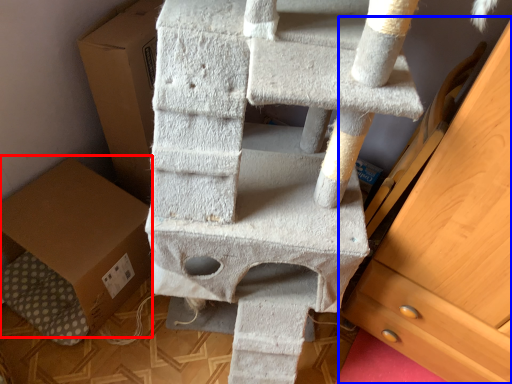
Question: Which object is closer to the camera taking this photo, cardboard box (highlighted by a red box) or chest of drawers (highlighted by a blue box)?

Choices:
 (A) cardboard box
 (B) chest of drawers

Answer: (B)